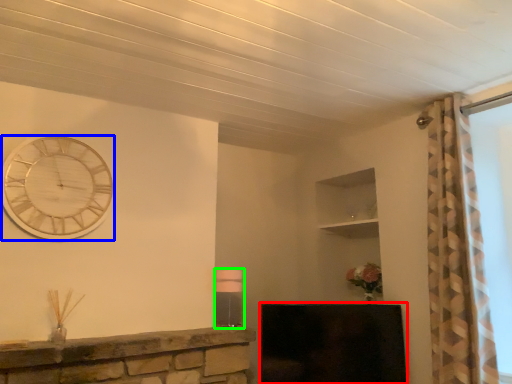
Question: Based on their relative distances, which object is farther from fireplace (highlighted by a red box)? Choose from wall clock (highlighted by a blue box) and lamp (highlighted by a green box).

Choices:
 (A) wall clock
 (B) lamp

Answer: (A)